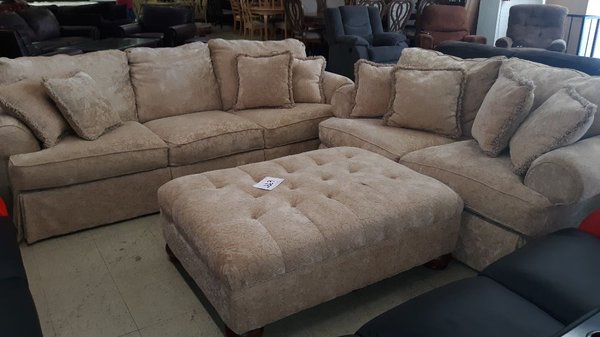
Where is `black table`? This screenshot has height=337, width=600. black table is located at coordinates (123, 40).